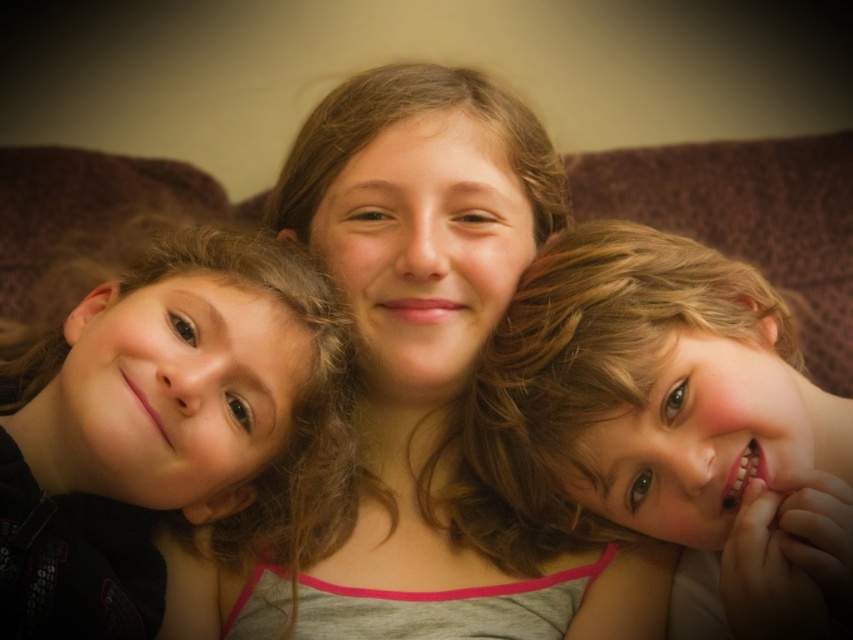
Who is more distant from viewer, [460,186] or [831,230]?

Positioned behind is point [831,230].

Between smooth skin face at center and brown fabric couch at center, which one has more height?

smooth skin face at center is taller.

Describe the element at coordinates (438, 356) in the screenshot. The height and width of the screenshot is (640, 853). I see `smooth skin face at center` at that location.

The width and height of the screenshot is (853, 640). I want to click on smooth skin face at center, so click(x=438, y=356).

Does dark brown hair at left appear on the left side of brown fabric couch at center?

Indeed, dark brown hair at left is positioned on the left side of brown fabric couch at center.

Consider the image. Which is more to the right, dark brown hair at left or brown fabric couch at center?

brown fabric couch at center

Is point (82, 474) less distant than point (668, 157)?

That is True.

Identify the location of dark brown hair at left. This screenshot has width=853, height=640. (164, 426).

Does smooth skin child at center appear under dark brown hair at left?

Indeed, smooth skin child at center is positioned under dark brown hair at left.

Can you confirm if smooth skin child at center is positioned above dark brown hair at left?

Incorrect, smooth skin child at center is not positioned above dark brown hair at left.

Does point (738, 397) come closer to viewer compared to point (212, 387)?

Yes.

Locate an element on the screen. This screenshot has width=853, height=640. smooth skin child at center is located at coordinates (672, 428).